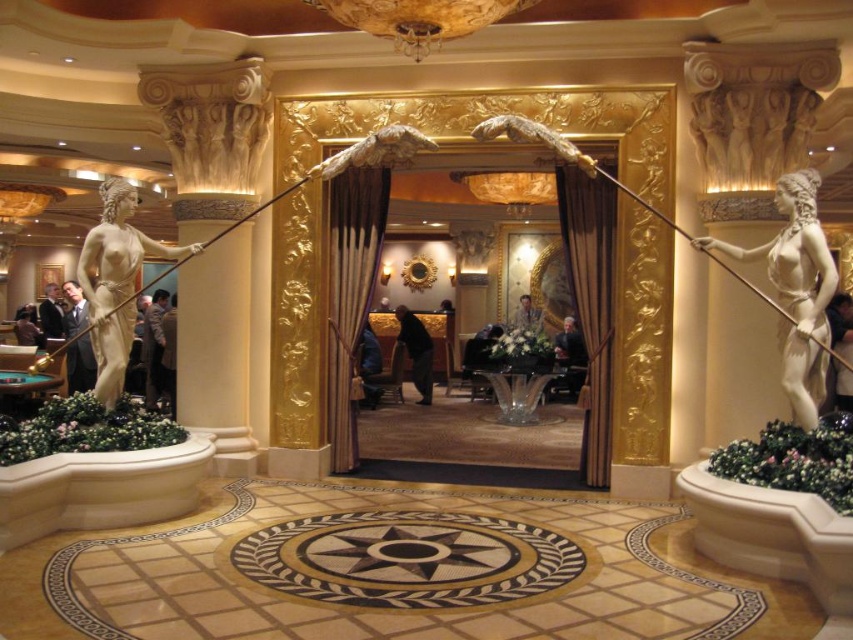
You are standing in the luxurious entrance and want to take a photo. There are two points marked in the scene, point 1 at coordinates point (816,244) and point 2 at coordinates point (120,337). Which point should you focus on first if you want to capture the closest point to the camera in your photo?

Point (816,244) is closer to the camera than point (120,337), so you should focus on point (816,244) first to capture the closest point in your photo.

You are standing at the center of the grand entrance and want to place a new decorative item exactly at the center of the circular tile motif on the floor. The white marble statue at right is currently blocking your path. Can you move the statue to make space?

The white marble statue at right is located at point (x=796, y=291), which is not at the center of the circular tile motif. Moving it would depend on its placement relative to the desired location, but since the statue is not at the center, you could potentially move it to allow access.

You are an interior designer tasked with placing a new 1.8 meter tall decorative column between the white marble statue at right and the matte gold statue at left. Based on their heights, will the column be taller than both statues?

The white marble statue at right is taller than the matte gold statue at left. Since the column is 1.8 meters tall, we need to know the exact heights of both statues to determine if the column is taller than both. However, the provided information only states a comparative height between the two statues, not their specific measurements. Therefore, it is impossible to definitively answer whether the column will be taller than both statues based on the given data.